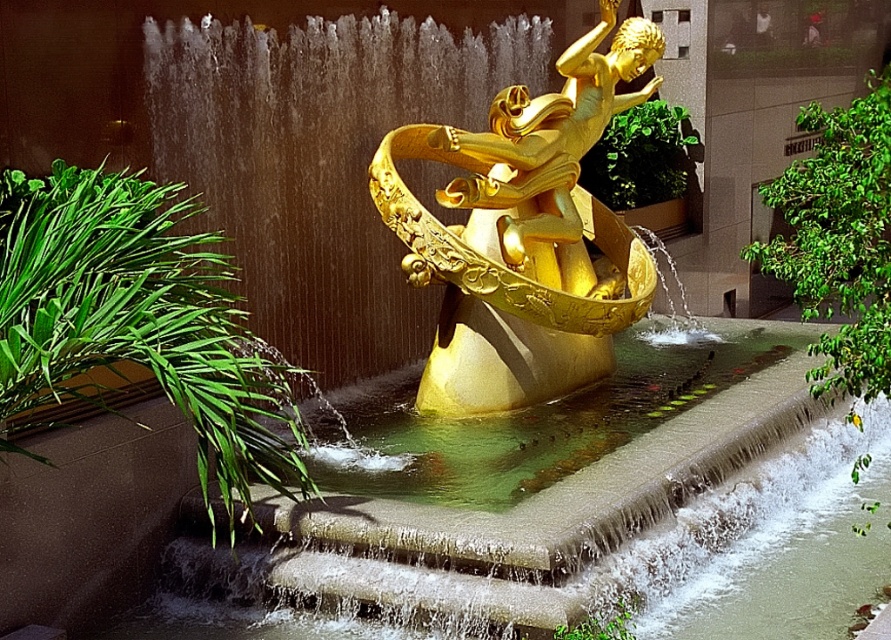
You are standing at the base of the fountain and want to place a small decorative item on the green leafy plant at right. Given that the item is 1 meter in diameter, will it fit on the plant?

The distance between the base of the fountain and the green leafy plant at right is 7.42 meters. Since the item is only 1 meter in diameter, it will fit on the plant as long as the plant itself is large enough to accommodate it. However, the question does not provide information about the plant size, so we can only confirm the distance is sufficient for placement.

You are a landscape architect designing a garden around the golden sculpture. You need to place a new decorative item between the green leafy plant at right and the green leafy plant at lower center. Which plant should the item be closer to to ensure it doesn

The green leafy plant at right is wider than the green leafy plant at lower center. To ensure the decorative item is placed appropriately between them, it should be closer to the narrower plant at lower center to maintain balance.

You are a gardener tasked with trimming plants to ensure they are all the same height. You observe the green leafy plant at left and the green leafy plant at right. Which plant should you trim to achieve uniform height?

The green leafy plant at left is shorter than the green leafy plant at right, so you should trim the taller green leafy plant at right to match the height of the shorter one.